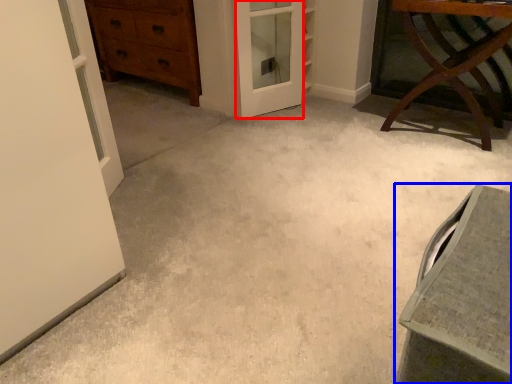
Question: Which object appears farthest to the camera in this image, screen door (highlighted by a red box) or vanity (highlighted by a blue box)?

Choices:
 (A) screen door
 (B) vanity

Answer: (A)